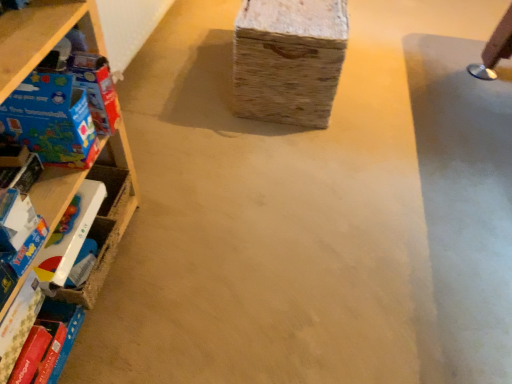
Question: Is wooden at left completely or partially inside matte plastic toy at left, which ranks as the 4th toy in top-to-bottom order?

Choices:
 (A) yes
 (B) no

Answer: (B)

Question: Is matte plastic toy at left, which ranks as the 4th toy in top-to-bottom order, positioned before wooden at left?

Choices:
 (A) no
 (B) yes

Answer: (A)

Question: Can you confirm if matte plastic toy at left, which ranks as the 4th toy in top-to-bottom order, is smaller than wooden at left?

Choices:
 (A) no
 (B) yes

Answer: (B)

Question: From the image's perspective, does matte plastic toy at left, which ranks as the 4th toy in top-to-bottom order, appear higher than wooden at left?

Choices:
 (A) no
 (B) yes

Answer: (A)

Question: Does matte plastic toy at left, the first toy positioned from the bottom, have a lesser width compared to wooden at left?

Choices:
 (A) yes
 (B) no

Answer: (A)

Question: Is the depth of matte plastic toy at left, which ranks as the 4th toy in top-to-bottom order, greater than that of wooden at left?

Choices:
 (A) no
 (B) yes

Answer: (B)

Question: Is matte plastic toy at left, which ranks as the 4th toy in top-to-bottom order, oriented towards matte plastic toy at left, marked as the 2th toy in a bottom-to-top arrangement?

Choices:
 (A) no
 (B) yes

Answer: (A)

Question: Could matte plastic toy at left, marked as the 2th toy in a bottom-to-top arrangement, be considered to be inside matte plastic toy at left, which ranks as the 4th toy in top-to-bottom order?

Choices:
 (A) no
 (B) yes

Answer: (A)

Question: Is matte plastic toy at left, the first toy positioned from the bottom, not within matte plastic toy at left, marked as the 2th toy in a bottom-to-top arrangement?

Choices:
 (A) no
 (B) yes

Answer: (B)

Question: Is matte plastic toy at left, which ranks as the 4th toy in top-to-bottom order, taller than matte plastic toy at left, positioned as the third toy in top-to-bottom order?

Choices:
 (A) yes
 (B) no

Answer: (B)

Question: Does matte plastic toy at left, which ranks as the 4th toy in top-to-bottom order, appear on the left side of matte plastic toy at left, marked as the 2th toy in a bottom-to-top arrangement?

Choices:
 (A) yes
 (B) no

Answer: (B)

Question: Can you confirm if matte plastic toy at left, the first toy positioned from the bottom, is wider than matte plastic toy at left, marked as the 2th toy in a bottom-to-top arrangement?

Choices:
 (A) no
 (B) yes

Answer: (A)

Question: Does matte plastic toy at left, marked as the 2th toy in a bottom-to-top arrangement, turn towards matte plastic toy at left, the first toy positioned from the bottom?

Choices:
 (A) yes
 (B) no

Answer: (B)